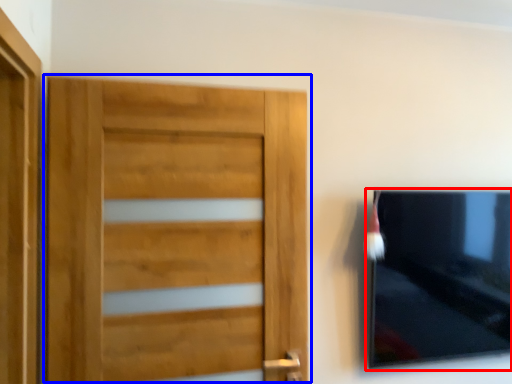
Question: Which point is closer to the camera, picture frame (highlighted by a red box) or door (highlighted by a blue box)?

Choices:
 (A) picture frame
 (B) door

Answer: (B)